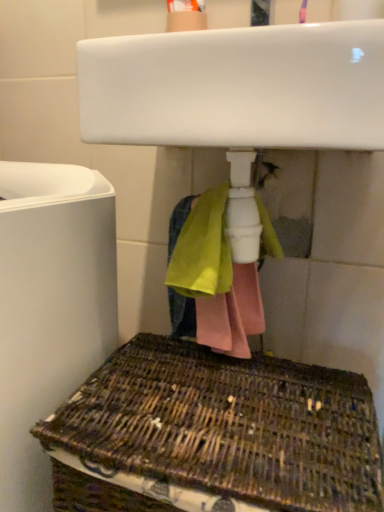
Question: Is woven brown basket at lower center inside white glossy sink at upper center?

Choices:
 (A) yes
 (B) no

Answer: (B)

Question: Does white glossy sink at upper center have a lesser height compared to woven brown basket at lower center?

Choices:
 (A) no
 (B) yes

Answer: (B)

Question: From a real-world perspective, is white glossy sink at upper center physically below woven brown basket at lower center?

Choices:
 (A) yes
 (B) no

Answer: (B)

Question: Considering the relative sizes of white glossy sink at upper center and woven brown basket at lower center in the image provided, is white glossy sink at upper center wider than woven brown basket at lower center?

Choices:
 (A) no
 (B) yes

Answer: (A)

Question: Considering the relative positions of white glossy sink at upper center and woven brown basket at lower center in the image provided, is white glossy sink at upper center behind woven brown basket at lower center?

Choices:
 (A) no
 (B) yes

Answer: (B)

Question: Is white glossy sink at upper center positioned with its back to woven brown basket at lower center?

Choices:
 (A) no
 (B) yes

Answer: (A)

Question: From a real-world perspective, is white matte toilet at left beneath white glossy sink at upper center?

Choices:
 (A) yes
 (B) no

Answer: (A)

Question: Is white matte toilet at left facing away from white glossy sink at upper center?

Choices:
 (A) yes
 (B) no

Answer: (B)

Question: Considering the relative sizes of white matte toilet at left and white glossy sink at upper center in the image provided, is white matte toilet at left wider than white glossy sink at upper center?

Choices:
 (A) yes
 (B) no

Answer: (A)

Question: Is white matte toilet at left not close to white glossy sink at upper center?

Choices:
 (A) yes
 (B) no

Answer: (B)

Question: Does white matte toilet at left have a lesser width compared to white glossy sink at upper center?

Choices:
 (A) no
 (B) yes

Answer: (A)

Question: From the image's perspective, does white matte toilet at left appear lower than white glossy sink at upper center?

Choices:
 (A) no
 (B) yes

Answer: (B)

Question: Considering the relative positions of woven brown basket at lower center and white matte toilet at left in the image provided, is woven brown basket at lower center to the right of white matte toilet at left from the viewer's perspective?

Choices:
 (A) yes
 (B) no

Answer: (A)